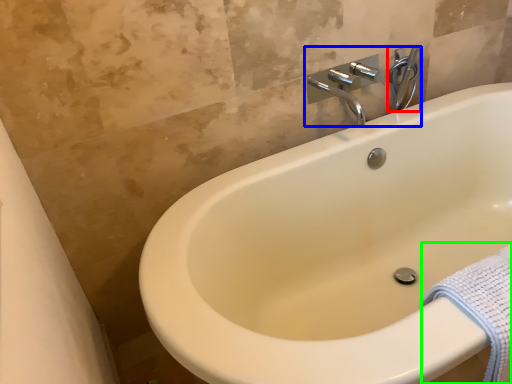
Question: Which object is positioned closest to plumbing fixture (highlighted by a red box)? Select from tap (highlighted by a blue box) and bath towel (highlighted by a green box).

Choices:
 (A) tap
 (B) bath towel

Answer: (A)